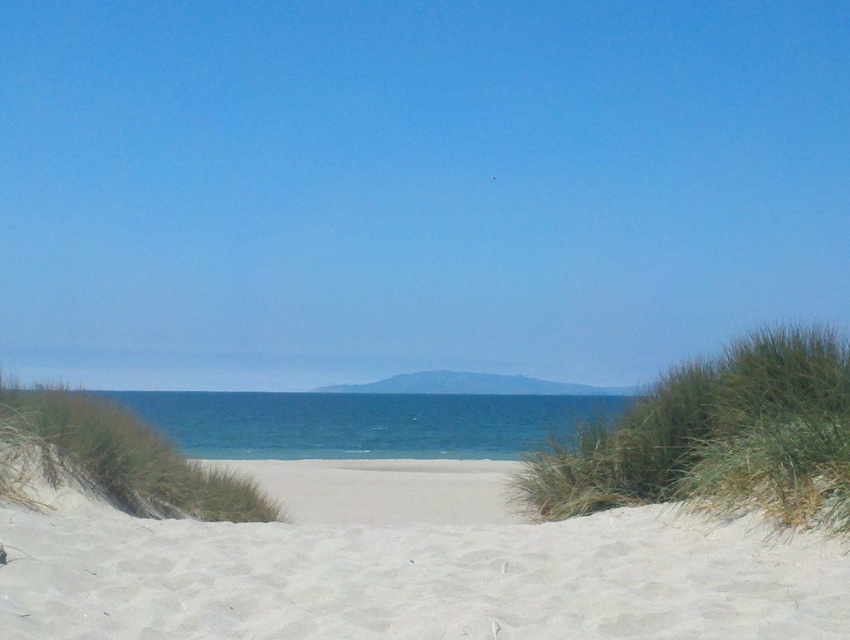
Question: Can you confirm if white sandy beach at center is bigger than blue water at center?

Choices:
 (A) yes
 (B) no

Answer: (B)

Question: Among these points, which one is farthest from the camera?

Choices:
 (A) (230, 440)
 (B) (632, 540)

Answer: (A)

Question: Does white sandy beach at center have a lesser width compared to blue water at center?

Choices:
 (A) yes
 (B) no

Answer: (A)

Question: Does white sandy beach at center have a lesser width compared to blue water at center?

Choices:
 (A) no
 (B) yes

Answer: (B)